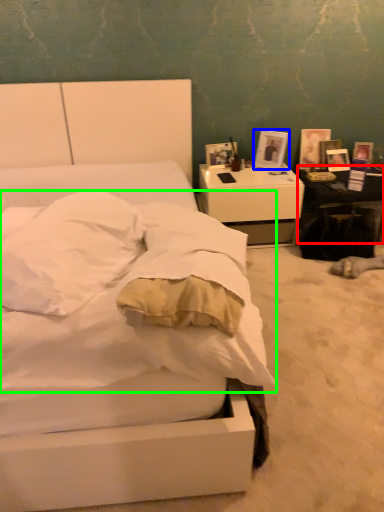
Question: Which object is positioned closest to table (highlighted by a red box)? Select from picture frame (highlighted by a blue box) and mattress (highlighted by a green box).

Choices:
 (A) picture frame
 (B) mattress

Answer: (A)